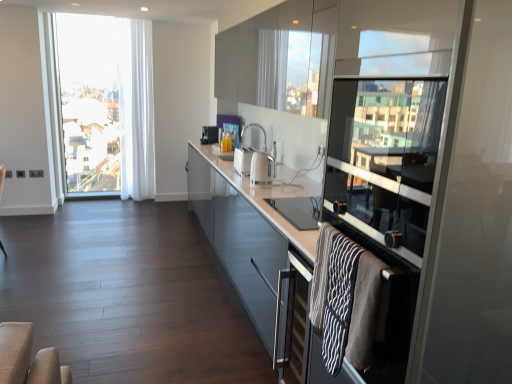
Question: Is white glossy electric kettle at center, the 3th appliance positioned from the left, taller or shorter than glossy glass cabinets at upper center, which is the 2th cabinetry in bottom-to-top order?

Choices:
 (A) short
 (B) tall

Answer: (A)

Question: From a real-world perspective, relative to glossy glass cabinets at upper center, which is the 2th cabinetry in bottom-to-top order, is white glossy electric kettle at center, the 1th appliance viewed from the right, vertically above or below?

Choices:
 (A) above
 (B) below

Answer: (B)

Question: Estimate the real-world distances between objects in this image. Which object is closer to the white glossy electric kettle at center, the 3th appliance positioned from the left?

Choices:
 (A) transparent glass window screen at right
 (B) satin silver toaster at center, the 3th appliance when ordered from front to back
 (C) white sheer curtain at left
 (D) glossy glass cabinet at center, positioned as the 1th cabinetry in bottom-to-top order
 (E) clear glass window at left

Answer: (D)

Question: Considering the real-world distances, which object is farthest from the white sheer curtain at left?

Choices:
 (A) white glossy toaster at center, marked as the second appliance in a back-to-front arrangement
 (B) transparent glass screen door at right
 (C) glossy glass cabinet at center, positioned as the 1th cabinetry in bottom-to-top order
 (D) glossy glass cabinets at upper center, which is the 2th cabinetry in bottom-to-top order
 (E) satin silver toaster at center, which ranks as the 1th appliance in back-to-front order

Answer: (B)